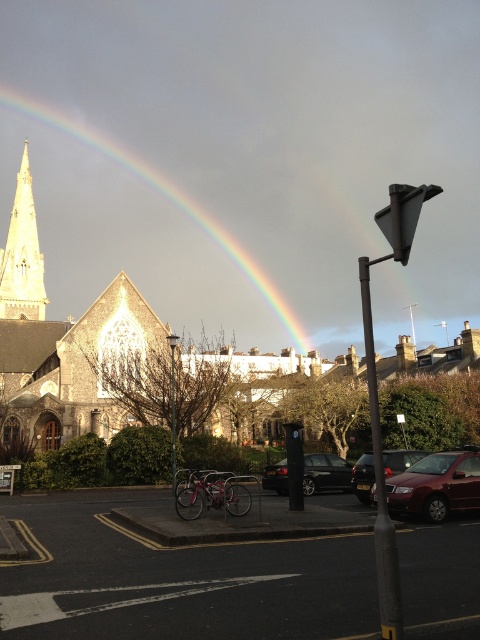
Question: Which point is closer to the camera?

Choices:
 (A) (87, 132)
 (B) (429, 481)
 (C) (325, 454)
 (D) (6, 253)

Answer: (B)

Question: Is shiny maroon sedan at lower right to the left of black glossy car at center from the viewer's perspective?

Choices:
 (A) no
 (B) yes

Answer: (A)

Question: Can you confirm if light beige stone spire at upper left is wider than shiny metallic car at lower right?

Choices:
 (A) no
 (B) yes

Answer: (B)

Question: Which point appears farthest from the camera in this image?

Choices:
 (A) (17, 241)
 (B) (370, 488)
 (C) (265, 465)
 (D) (56, 112)

Answer: (D)

Question: Can you confirm if black glossy car at center is positioned above shiny metallic car at lower right?

Choices:
 (A) no
 (B) yes

Answer: (A)

Question: Which object is positioned closest to the rainbow translucent at upper center?

Choices:
 (A) light beige stone spire at upper left
 (B) shiny metallic car at lower right

Answer: (A)